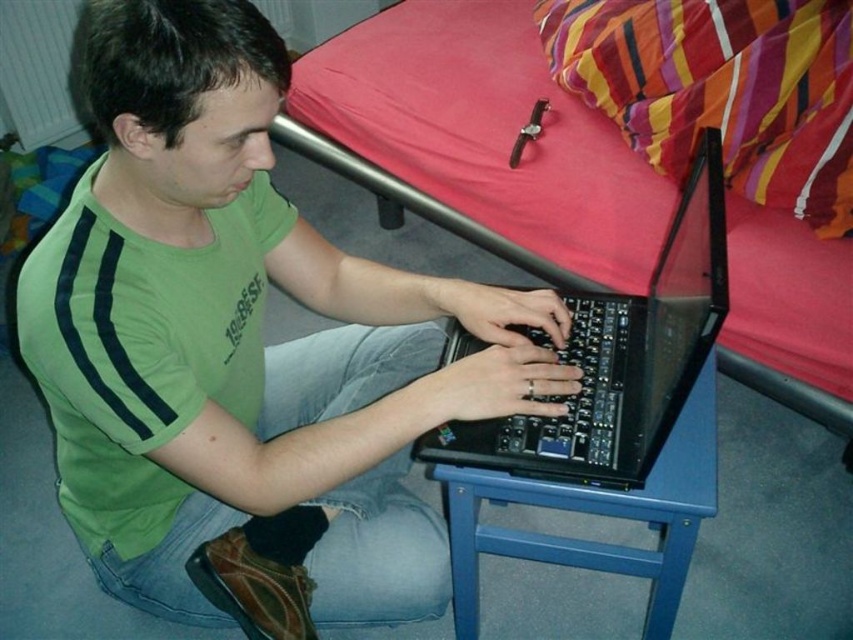
Is point (173, 307) positioned behind point (462, 506)?

No, (173, 307) is closer to viewer.

Who is taller, green fabric shirt at center or blue plastic stool at lower center?

green fabric shirt at center

What do you see at coordinates (242, 337) in the screenshot? I see `green fabric shirt at center` at bounding box center [242, 337].

Image resolution: width=853 pixels, height=640 pixels. I want to click on green fabric shirt at center, so click(x=242, y=337).

Is green fabric shirt at center to the left of black plastic laptop at center from the viewer's perspective?

Indeed, green fabric shirt at center is positioned on the left side of black plastic laptop at center.

Is green fabric shirt at center bigger than black plastic laptop at center?

Correct, green fabric shirt at center is larger in size than black plastic laptop at center.

Who is more forward, (550, 298) or (660, 292)?

Point (550, 298) is more forward.

You are a GUI agent. You are given a task and a screenshot of the screen. Output one action in this format:
    pyautogui.click(x=<x>, y=<y>)
    Task: Click on the green fabric shirt at center
    The width and height of the screenshot is (853, 640).
    Given the screenshot: What is the action you would take?
    pyautogui.click(x=242, y=337)

Between green fabric shirt at center and pink fabric bed at upper center, which one is positioned higher?

pink fabric bed at upper center is above.

Who is positioned more to the left, green fabric shirt at center or pink fabric bed at upper center?

Positioned to the left is green fabric shirt at center.

Does point (91, 444) come farther from viewer compared to point (839, 273)?

No.

Where is `green fabric shirt at center`? The height and width of the screenshot is (640, 853). green fabric shirt at center is located at coordinates (242, 337).